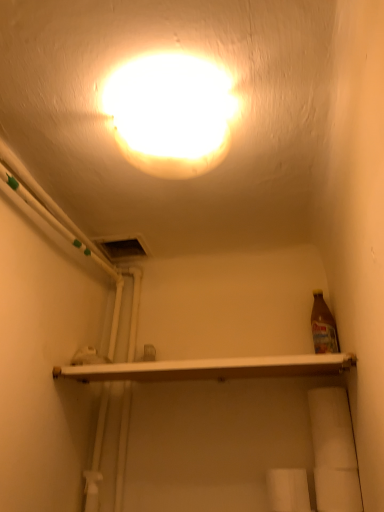
Question: Is white matte toilet paper at lower right, the first toilet paper from the right, closer to the viewer compared to matte white light at upper center?

Choices:
 (A) yes
 (B) no

Answer: (B)

Question: Is white matte toilet paper at lower right, the first toilet paper from the right, far from matte white light at upper center?

Choices:
 (A) yes
 (B) no

Answer: (B)

Question: Does white matte toilet paper at lower right, which is the 2th toilet paper in left-to-right order, turn towards matte white light at upper center?

Choices:
 (A) yes
 (B) no

Answer: (B)

Question: From a real-world perspective, is white matte toilet paper at lower right, the first toilet paper from the right, on top of matte white light at upper center?

Choices:
 (A) yes
 (B) no

Answer: (B)

Question: Is white matte toilet paper at lower right, the first toilet paper from the right, facing away from matte white light at upper center?

Choices:
 (A) yes
 (B) no

Answer: (B)

Question: From a real-world perspective, is white glossy shelf at center above or below matte white light at upper center?

Choices:
 (A) above
 (B) below

Answer: (B)

Question: In terms of width, does white glossy shelf at center look wider or thinner when compared to matte white light at upper center?

Choices:
 (A) wide
 (B) thin

Answer: (A)

Question: Is white glossy shelf at center bigger or smaller than matte white light at upper center?

Choices:
 (A) small
 (B) big

Answer: (B)

Question: Is point (218, 359) closer or farther from the camera than point (208, 133)?

Choices:
 (A) farther
 (B) closer

Answer: (A)

Question: Is matte white light at upper center bigger or smaller than white matte toilet paper at lower right, the first toilet paper from the right?

Choices:
 (A) big
 (B) small

Answer: (A)

Question: Does point [137, 92] appear closer or farther from the camera than point [322, 493]?

Choices:
 (A) farther
 (B) closer

Answer: (B)

Question: Considering the positions of matte white light at upper center and white matte toilet paper at lower right, the first toilet paper from the right, in the image, is matte white light at upper center wider or thinner than white matte toilet paper at lower right, the first toilet paper from the right,?

Choices:
 (A) wide
 (B) thin

Answer: (A)

Question: From a real-world perspective, is matte white light at upper center positioned above or below white matte toilet paper at lower right, the first toilet paper from the right?

Choices:
 (A) above
 (B) below

Answer: (A)

Question: In the image, is white matte toilet paper at lower right, which is the 2th toilet paper in left-to-right order, positioned in front of or behind white matte toilet paper at lower center, positioned as the 2th toilet paper in right-to-left order?

Choices:
 (A) behind
 (B) front

Answer: (B)

Question: Looking at their shapes, would you say white matte toilet paper at lower right, which is the 2th toilet paper in left-to-right order, is wider or thinner than white matte toilet paper at lower center, positioned as the 2th toilet paper in right-to-left order?

Choices:
 (A) wide
 (B) thin

Answer: (B)